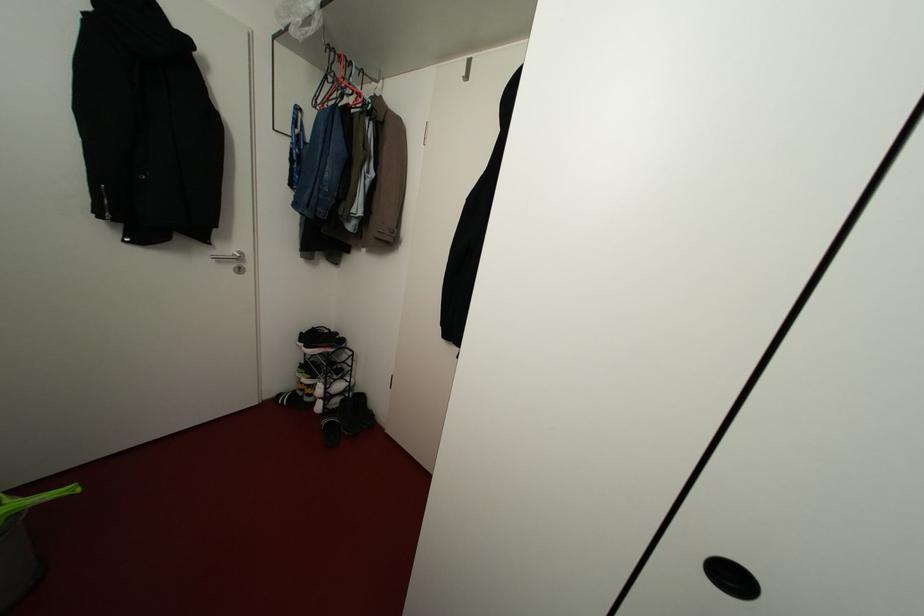
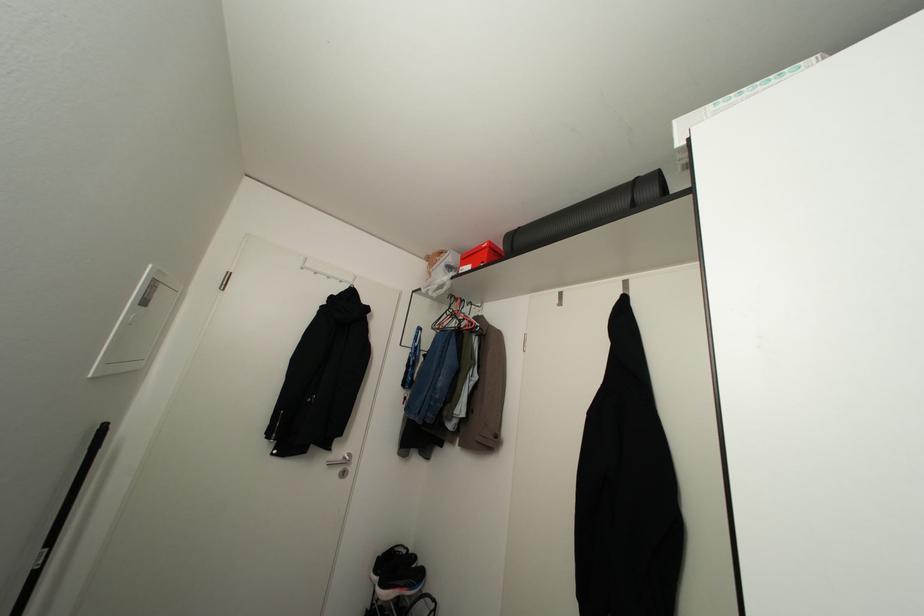
Find the pixel in the second image that matches point (330, 47) in the first image.

(451, 294)